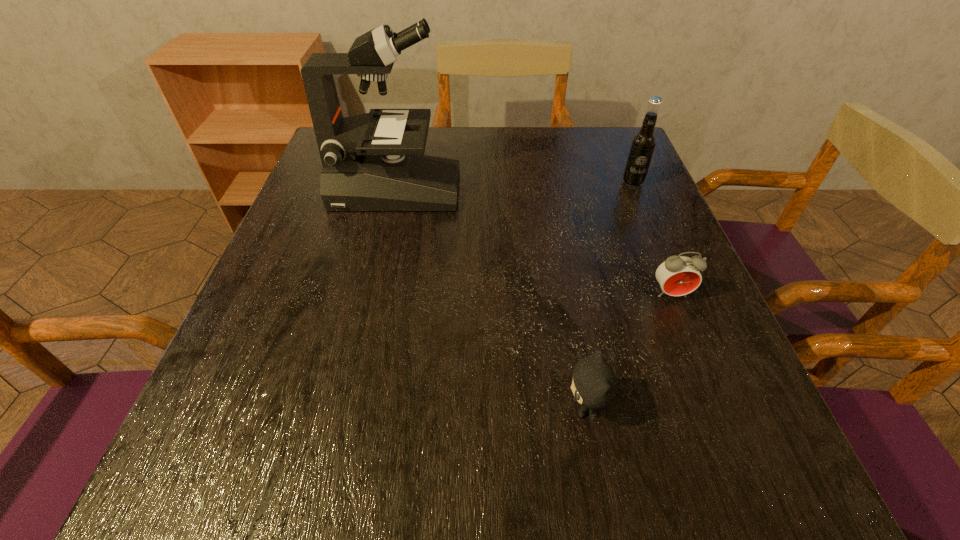
The width and height of the screenshot is (960, 540). In the image, there is a desktop. What are the coordinates of `vacant space at the right edge` in the screenshot? It's located at (637, 214).

Locate an element on the screen. free region at the far right corner of the desktop is located at coordinates (x=577, y=127).

Find the location of a particular element. vacant space at the near right corner of the desktop is located at coordinates (667, 451).

You are a GUI agent. You are given a task and a screenshot of the screen. Output one action in this format:
    pyautogui.click(x=<x>, y=<y>)
    Task: Click on the free spot between the third farthest object and the tallest object
    
    Given the screenshot: What is the action you would take?
    pyautogui.click(x=534, y=242)

Identify the location of free space between the tallest object and the nearest object. (491, 299).

Locate an element on the screen. The width and height of the screenshot is (960, 540). free space between the tallest object and the nearest object is located at coordinates (491, 299).

The width and height of the screenshot is (960, 540). Identify the location of vacant region between the second object from left to right and the second nearest object. (628, 351).

Image resolution: width=960 pixels, height=540 pixels. Identify the location of free space between the third farthest object and the root beer. (652, 239).

Where is `empty location between the third shortest object and the alarm clock`? The height and width of the screenshot is (540, 960). empty location between the third shortest object and the alarm clock is located at coordinates (652, 239).

Where is `free point between the microscope and the root beer`? This screenshot has width=960, height=540. free point between the microscope and the root beer is located at coordinates (515, 186).